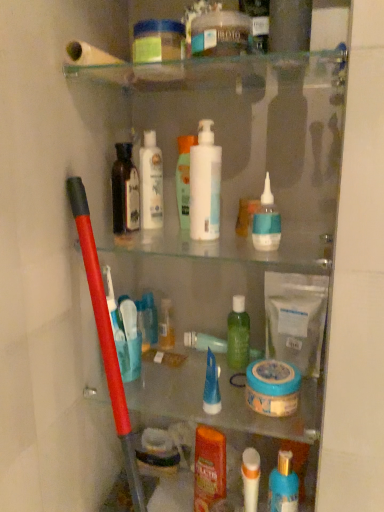
At what (x,y) coordinates should I click in order to perform the action: click on white glossy mouthwash at center, the first mouthwash viewed from the left. Please return your answer as a coordinate pair (x, y). The image size is (384, 512). Looking at the image, I should click on (184, 178).

What do you see at coordinates (184, 178) in the screenshot? The width and height of the screenshot is (384, 512). I see `white glossy mouthwash at center, which is counted as the 2th mouthwash, starting from the right` at bounding box center [184, 178].

The height and width of the screenshot is (512, 384). What do you see at coordinates (166, 325) in the screenshot?
I see `translucent plastic bottle at center, which ranks as the eighth toiletry in right-to-left order` at bounding box center [166, 325].

What are the coordinates of `orange plastic shampoo at center, which is counted as the fifth toiletry, starting from the right` in the screenshot? It's located at (209, 467).

The image size is (384, 512). What do you see at coordinates (250, 478) in the screenshot?
I see `white matte toothbrush at lower center, arranged as the eighth toiletry when viewed from the left` at bounding box center [250, 478].

Image resolution: width=384 pixels, height=512 pixels. Describe the element at coordinates (272, 387) in the screenshot. I see `blue matte jar at center bottom, which is the first mouthwash from right to left` at that location.

Image resolution: width=384 pixels, height=512 pixels. In order to click on white glossy mouthwash at center, which appears as the first mouthwash when viewed from the top in this screenshot , I will do `click(184, 178)`.

Would you say white glossy mouthwash at center, which is counted as the 2th mouthwash, starting from the right, is to the left or to the right of blue gel tube at center, the sixth toiletry from the right, in the picture?

white glossy mouthwash at center, which is counted as the 2th mouthwash, starting from the right, is to the left of blue gel tube at center, the sixth toiletry from the right.

Identify the location of the 2nd toiletry to the right of the white glossy mouthwash at center, the first mouthwash viewed from the left, starting your count from the anchor. The image size is (384, 512). (211, 387).

How different are the orientations of white glossy mouthwash at center, which appears as the first mouthwash when viewed from the top, and blue gel tube at center, the sixth toiletry from the right, in degrees?

The angle between the facing direction of white glossy mouthwash at center, which appears as the first mouthwash when viewed from the top, and the facing direction of blue gel tube at center, the sixth toiletry from the right, is 0.00211 degrees.

From a real-world perspective, which object stands above the other?

blue glossy nasal spray at upper center, which is counted as the ninth toiletry, starting from the left, is physically above.

Can you confirm if blue glossy nasal spray at upper center, which is the second toiletry in right-to-left order, is wider than translucent plastic bottle at center, the 3th toiletry when ordered from left to right?

Yes.

Can we say blue glossy nasal spray at upper center, which is counted as the ninth toiletry, starting from the left, lies outside translucent plastic bottle at center, the 3th toiletry when ordered from left to right?

blue glossy nasal spray at upper center, which is counted as the ninth toiletry, starting from the left, is positioned outside translucent plastic bottle at center, the 3th toiletry when ordered from left to right.

What's the angular difference between blue glossy nasal spray at upper center, which is the second toiletry in right-to-left order, and translucent plastic bottle at center, the 3th toiletry when ordered from left to right,'s facing directions?

The angular difference between blue glossy nasal spray at upper center, which is the second toiletry in right-to-left order, and translucent plastic bottle at center, the 3th toiletry when ordered from left to right, is 0.00272 degrees.

From a real-world perspective, between green translucent bottle at center, which ranks as the fourth toiletry in right-to-left order, and blue glossy nasal spray at upper center, which is counted as the ninth toiletry, starting from the left, who is vertically higher?

blue glossy nasal spray at upper center, which is counted as the ninth toiletry, starting from the left.

Between green translucent bottle at center, which ranks as the fourth toiletry in right-to-left order, and blue glossy nasal spray at upper center, which is counted as the ninth toiletry, starting from the left, which one has less height?

Standing shorter between the two is blue glossy nasal spray at upper center, which is counted as the ninth toiletry, starting from the left.

Is blue glossy nasal spray at upper center, which is the second toiletry in right-to-left order, at the back of green translucent bottle at center, acting as the seventh toiletry starting from the left?

green translucent bottle at center, acting as the seventh toiletry starting from the left, does not have its back to blue glossy nasal spray at upper center, which is the second toiletry in right-to-left order.

Is white matte toothbrush at lower center, arranged as the eighth toiletry when viewed from the left, to the right of translucent plastic bottle at center, which ranks as the eighth toiletry in right-to-left order, from the viewer's perspective?

Yes, white matte toothbrush at lower center, arranged as the eighth toiletry when viewed from the left, is to the right of translucent plastic bottle at center, which ranks as the eighth toiletry in right-to-left order.

Is white matte toothbrush at lower center, arranged as the eighth toiletry when viewed from the left, in contact with translucent plastic bottle at center, which ranks as the eighth toiletry in right-to-left order?

No, white matte toothbrush at lower center, arranged as the eighth toiletry when viewed from the left, is not touching translucent plastic bottle at center, which ranks as the eighth toiletry in right-to-left order.

Considering the sizes of blue glossy nasal spray at upper center, which is the second toiletry in right-to-left order, and white glossy mouthwash at center, which appears as the first mouthwash when viewed from the top, in the image, is blue glossy nasal spray at upper center, which is the second toiletry in right-to-left order, wider or thinner than white glossy mouthwash at center, which appears as the first mouthwash when viewed from the top,?

In the image, blue glossy nasal spray at upper center, which is the second toiletry in right-to-left order, appears to be wider than white glossy mouthwash at center, which appears as the first mouthwash when viewed from the top.

From the image's perspective, is blue glossy nasal spray at upper center, which is the second toiletry in right-to-left order, under white glossy mouthwash at center, arranged as the second mouthwash when ordered from the bottom?

Correct, blue glossy nasal spray at upper center, which is the second toiletry in right-to-left order, appears lower than white glossy mouthwash at center, arranged as the second mouthwash when ordered from the bottom, in the image.

Can you tell me how much blue glossy nasal spray at upper center, which is the second toiletry in right-to-left order, and white glossy mouthwash at center, which appears as the first mouthwash when viewed from the top, differ in facing direction?

0.00154 degrees.

Which is behind, point (269, 199) or point (184, 203)?

The point (184, 203) is farther.

Is blue gel tube at center, the sixth toiletry from the right, spatially inside blue matte jar at center bottom, which is counted as the 2th mouthwash, starting from the left, or outside of it?

blue gel tube at center, the sixth toiletry from the right, is not inside blue matte jar at center bottom, which is counted as the 2th mouthwash, starting from the left, it's outside.

Which object is positioned more to the left, blue gel tube at center, the sixth toiletry from the right, or blue matte jar at center bottom, which is counted as the 2th mouthwash, starting from the left?

blue gel tube at center, the sixth toiletry from the right, is more to the left.

In terms of height, does blue gel tube at center, the sixth toiletry from the right, look taller or shorter compared to blue matte jar at center bottom, which is the first mouthwash from right to left?

In the image, blue gel tube at center, the sixth toiletry from the right, appears to be taller than blue matte jar at center bottom, which is the first mouthwash from right to left.

Is blue gel tube at center, which is counted as the 5th toiletry, starting from the left, oriented away from blue matte jar at center bottom, which is the first mouthwash from right to left?

blue gel tube at center, which is counted as the 5th toiletry, starting from the left, is not turned away from blue matte jar at center bottom, which is the first mouthwash from right to left.

Is translucent plastic bottle at center, the 3th toiletry when ordered from left to right, smaller than white glossy mouthwash at center, arranged as the second mouthwash when ordered from the bottom?

Yes, translucent plastic bottle at center, the 3th toiletry when ordered from left to right, is smaller than white glossy mouthwash at center, arranged as the second mouthwash when ordered from the bottom.

In the scene shown: Does translucent plastic bottle at center, which ranks as the eighth toiletry in right-to-left order, have a greater height compared to white glossy mouthwash at center, which is counted as the 2th mouthwash, starting from the right?

Incorrect, the height of translucent plastic bottle at center, which ranks as the eighth toiletry in right-to-left order, is not larger of that of white glossy mouthwash at center, which is counted as the 2th mouthwash, starting from the right.

Is translucent plastic bottle at center, which ranks as the eighth toiletry in right-to-left order, turned away from white glossy mouthwash at center, which appears as the first mouthwash when viewed from the top?

No.

From the white glossy mouthwash at center, the first mouthwash viewed from the left, count 2nd toiletry to the right and point to it. Please provide its 2D coordinates.

[(211, 387)]

Where is `toiletry that is the 2nd object above the translucent plastic bottle at center, the 3th toiletry when ordered from left to right (from a real-world perspective)`? The image size is (384, 512). toiletry that is the 2nd object above the translucent plastic bottle at center, the 3th toiletry when ordered from left to right (from a real-world perspective) is located at coordinates (266, 221).

From the image, which object appears to be farther from translucent plastic bottle at center, the 3th toiletry when ordered from left to right, white matte toothbrush at lower center, arranged as the 3th toiletry when viewed from the right, or white glossy lotion at center, the ninth toiletry positioned from the right?

white matte toothbrush at lower center, arranged as the 3th toiletry when viewed from the right.

Looking at the image, which one is located closer to dark brown glass bottle at upper left, acting as the 10th toiletry starting from the right, white glossy mouthwash at center, arranged as the second mouthwash when ordered from the bottom, or white matte toothbrush at lower center, arranged as the eighth toiletry when viewed from the left?

The object closer to dark brown glass bottle at upper left, acting as the 10th toiletry starting from the right, is white glossy mouthwash at center, arranged as the second mouthwash when ordered from the bottom.

Which object lies further to the anchor point blue gel tube at center, the sixth toiletry from the right, white matte pump bottle at center, the 4th toiletry positioned from the left, or dark brown glass bottle at upper left, acting as the 10th toiletry starting from the right?

Among the two, dark brown glass bottle at upper left, acting as the 10th toiletry starting from the right, is located further to blue gel tube at center, the sixth toiletry from the right.

When comparing their distances from blue matte jar at center bottom, which is the first mouthwash from right to left, does white glossy lotion at center, the ninth toiletry positioned from the right, or dark brown glass bottle at upper left, the 1th toiletry in the left-to-right sequence, seem further?

Among the two, dark brown glass bottle at upper left, the 1th toiletry in the left-to-right sequence, is located further to blue matte jar at center bottom, which is the first mouthwash from right to left.

From the image, which object appears to be farther from translucent plastic bottle at center, the 3th toiletry when ordered from left to right, blue gel tube at center, which is counted as the 5th toiletry, starting from the left, or white glossy mouthwash at center, which appears as the first mouthwash when viewed from the top?

white glossy mouthwash at center, which appears as the first mouthwash when viewed from the top, lies further to translucent plastic bottle at center, the 3th toiletry when ordered from left to right, than the other object.

When comparing their distances from white glossy mouthwash at center, which is counted as the 2th mouthwash, starting from the right, does dark brown glass bottle at upper left, acting as the 10th toiletry starting from the right, or green translucent bottle at center, which ranks as the fourth toiletry in right-to-left order, seem closer?

dark brown glass bottle at upper left, acting as the 10th toiletry starting from the right, lies closer to white glossy mouthwash at center, which is counted as the 2th mouthwash, starting from the right, than the other object.

Which object lies nearer to the anchor point blue gel tube at center, which is counted as the 5th toiletry, starting from the left, green translucent bottle at center, acting as the seventh toiletry starting from the left, or blue glossy nasal spray at upper center, which is the second toiletry in right-to-left order?

The object closer to blue gel tube at center, which is counted as the 5th toiletry, starting from the left, is green translucent bottle at center, acting as the seventh toiletry starting from the left.

Considering their positions, is orange plastic shampoo at center, the sixth toiletry from the left, positioned further to green translucent bottle at center, which ranks as the fourth toiletry in right-to-left order, than white matte pump bottle at center, the 4th toiletry positioned from the left?

white matte pump bottle at center, the 4th toiletry positioned from the left, lies further to green translucent bottle at center, which ranks as the fourth toiletry in right-to-left order, than the other object.

This screenshot has height=512, width=384. What are the coordinates of `mouthwash positioned between white matte pump bottle at center, the 4th toiletry positioned from the left, and white glossy lotion at center, arranged as the second toiletry when viewed from the left, from near to far` in the screenshot? It's located at (184, 178).

The height and width of the screenshot is (512, 384). I want to click on mouthwash between white matte pump bottle at center, marked as the seventh toiletry in a right-to-left arrangement, and white matte toothbrush at lower center, arranged as the 3th toiletry when viewed from the right, in the vertical direction, so click(x=272, y=387).

The height and width of the screenshot is (512, 384). In order to click on mouthwash between translucent plastic bottle at center, which ranks as the eighth toiletry in right-to-left order, and white matte toothbrush at lower center, arranged as the 3th toiletry when viewed from the right, in the up-down direction in this screenshot , I will do `click(272, 387)`.

Locate an element on the screen. This screenshot has width=384, height=512. mouthwash between green translucent bottle at center, which ranks as the fourth toiletry in right-to-left order, and white matte toothbrush at lower center, arranged as the eighth toiletry when viewed from the left, in the vertical direction is located at coordinates click(x=272, y=387).